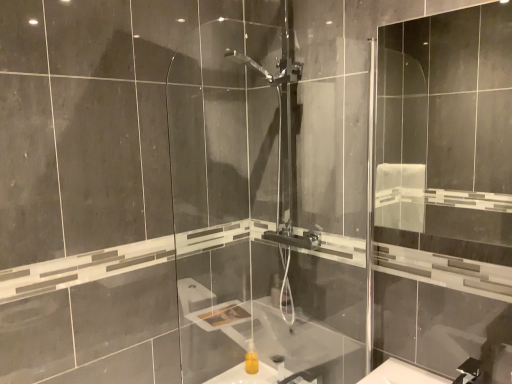
Question: Does yellow matte sink at center have a smaller size compared to transparent glass screen door at right, the first screen door positioned from the right?

Choices:
 (A) yes
 (B) no

Answer: (A)

Question: Is yellow matte sink at center positioned beyond the bounds of transparent glass screen door at right, the first screen door positioned from the right?

Choices:
 (A) no
 (B) yes

Answer: (B)

Question: Does yellow matte sink at center have a lesser width compared to transparent glass screen door at right, positioned as the second screen door in left-to-right order?

Choices:
 (A) yes
 (B) no

Answer: (B)

Question: Considering the relative sizes of yellow matte sink at center and transparent glass screen door at right, positioned as the second screen door in left-to-right order, in the image provided, is yellow matte sink at center wider than transparent glass screen door at right, positioned as the second screen door in left-to-right order,?

Choices:
 (A) no
 (B) yes

Answer: (B)

Question: Can you confirm if yellow matte sink at center is shorter than transparent glass screen door at right, positioned as the second screen door in left-to-right order?

Choices:
 (A) yes
 (B) no

Answer: (A)

Question: Visually, is transparent glass screen door at right, the first screen door positioned from the right, positioned to the left or to the right of transparent glass shower door at center, the 1th screen door from the left?

Choices:
 (A) left
 (B) right

Answer: (B)

Question: Is transparent glass screen door at right, the first screen door positioned from the right, in front of or behind transparent glass shower door at center, which is the 2th screen door in right-to-left order, in the image?

Choices:
 (A) behind
 (B) front

Answer: (A)

Question: From the image's perspective, is transparent glass screen door at right, the first screen door positioned from the right, positioned above or below transparent glass shower door at center, the 1th screen door from the left?

Choices:
 (A) below
 (B) above

Answer: (B)

Question: Is point (472, 38) closer or farther from the camera than point (204, 319)?

Choices:
 (A) farther
 (B) closer

Answer: (A)

Question: Looking at their shapes, would you say transparent glass screen door at right, the first screen door positioned from the right, is wider or thinner than yellow matte sink at center?

Choices:
 (A) wide
 (B) thin

Answer: (B)

Question: Is transparent glass screen door at right, positioned as the second screen door in left-to-right order, to the left or to the right of yellow matte sink at center in the image?

Choices:
 (A) left
 (B) right

Answer: (B)

Question: Is transparent glass screen door at right, the first screen door positioned from the right, in front of or behind yellow matte sink at center in the image?

Choices:
 (A) front
 (B) behind

Answer: (A)

Question: Is transparent glass screen door at right, the first screen door positioned from the right, inside the boundaries of yellow matte sink at center, or outside?

Choices:
 (A) inside
 (B) outside

Answer: (B)

Question: In the image, is yellow matte sink at center on the left side or the right side of transparent glass screen door at right, positioned as the second screen door in left-to-right order?

Choices:
 (A) right
 (B) left

Answer: (B)

Question: Considering the positions of point (244, 380) and point (423, 43), is point (244, 380) closer or farther from the camera than point (423, 43)?

Choices:
 (A) farther
 (B) closer

Answer: (B)